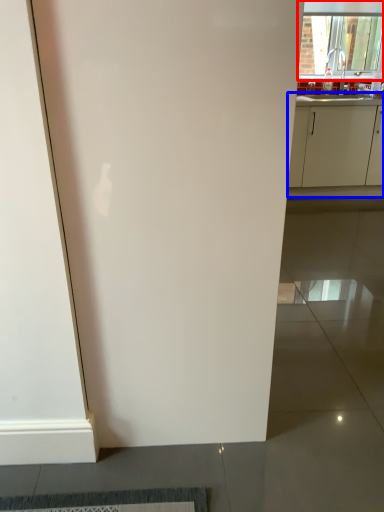
Question: Which object is closer to the camera taking this photo, window (highlighted by a red box) or cabinetry (highlighted by a blue box)?

Choices:
 (A) window
 (B) cabinetry

Answer: (B)